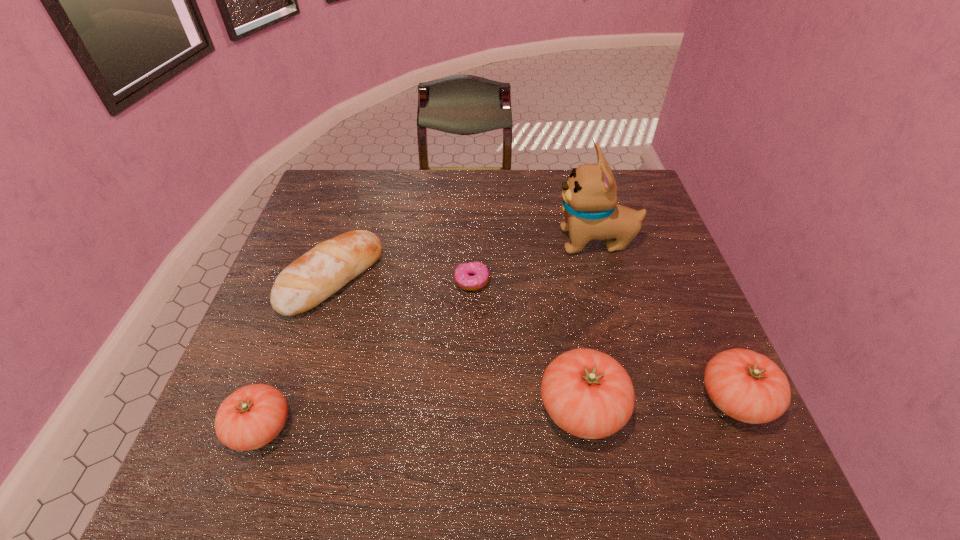
This screenshot has width=960, height=540. What are the coordinates of `free point between the leftmost tomato and the second tallest tomato` in the screenshot? It's located at (497, 413).

In order to click on free space between the shortest object and the puppy in this screenshot , I will do `click(534, 261)`.

Locate an element on the screen. This screenshot has height=540, width=960. vacant point located between the leftmost tomato and the second tomato from left to right is located at coordinates (421, 418).

This screenshot has width=960, height=540. Identify the location of vacant area that lies between the second tomato from left to right and the shortest tomato. (421, 418).

Locate an element on the screen. The width and height of the screenshot is (960, 540). vacant region between the bread and the shortest tomato is located at coordinates (297, 353).

Where is `free space that is in between the shortest object and the rightmost tomato`? The width and height of the screenshot is (960, 540). free space that is in between the shortest object and the rightmost tomato is located at coordinates (603, 340).

Image resolution: width=960 pixels, height=540 pixels. Find the location of `free space between the shortest tomato and the bread`. free space between the shortest tomato and the bread is located at coordinates (297, 353).

Choose which object is the second nearest neighbor to the bread. Please provide its 2D coordinates. Your answer should be formatted as a tuple, i.e. [(x, y)], where the tuple contains the x and y coordinates of a point satisfying the conditions above.

[(252, 416)]

Find the location of a particular element. The image size is (960, 540). object identified as the fifth closest to the leftmost tomato is located at coordinates (747, 386).

Identify the location of the closest tomato to the second tomato from right to left. The height and width of the screenshot is (540, 960). (747, 386).